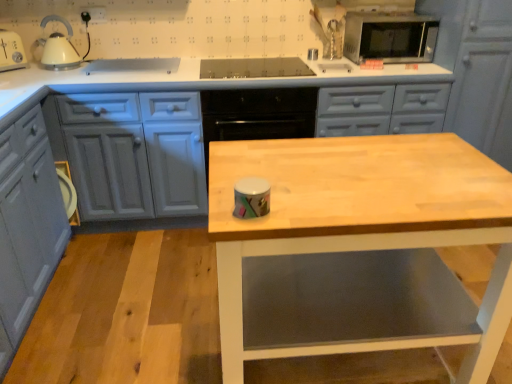
Question: Does point (358, 76) appear closer or farther from the camera than point (497, 122)?

Choices:
 (A) farther
 (B) closer

Answer: (B)

Question: Looking at the image, does matte gray cabinets at center, the second cabinetry when ordered from left to right, seem bigger or smaller compared to matte gray cabinet at upper right, placed as the 1th cabinetry when sorted from right to left?

Choices:
 (A) small
 (B) big

Answer: (B)

Question: Which is farther from the matte gray cabinets at center, the second cabinetry when ordered from left to right?

Choices:
 (A) matte gray cabinet at upper right, placed as the 1th cabinetry when sorted from right to left
 (B) wooden table at center
 (C) matte gray cabinet at lower left, the 1th cabinetry from the left

Answer: (B)

Question: Considering the real-world distances, which object is farthest from the matte gray cabinet at lower left, the third cabinetry viewed from the right?

Choices:
 (A) matte gray cabinets at center, the second cabinetry when ordered from left to right
 (B) wooden table at center
 (C) matte gray cabinet at upper right, placed as the 1th cabinetry when sorted from right to left

Answer: (C)